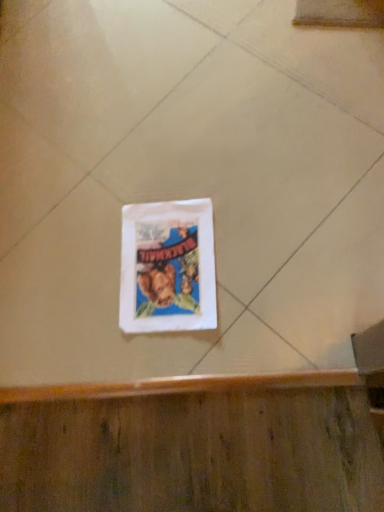
Question: From the image's perspective, is white paper bag at center positioned above or below white paper bag at center?

Choices:
 (A) above
 (B) below

Answer: (B)

Question: Does point (192, 212) appear closer or farther from the camera than point (124, 168)?

Choices:
 (A) farther
 (B) closer

Answer: (B)

Question: Would you say white paper bag at center is inside or outside white paper bag at center?

Choices:
 (A) inside
 (B) outside

Answer: (A)

Question: Looking at their shapes, would you say white paper bag at center is wider or thinner than white paper bag at center?

Choices:
 (A) thin
 (B) wide

Answer: (B)

Question: From a real-world perspective, relative to white paper bag at center, is white paper bag at center vertically above or below?

Choices:
 (A) below
 (B) above

Answer: (B)

Question: Looking at the image, does white paper bag at center seem bigger or smaller compared to white paper bag at center?

Choices:
 (A) big
 (B) small

Answer: (A)

Question: Relative to white paper bag at center, is white paper bag at center in front or behind?

Choices:
 (A) behind
 (B) front

Answer: (B)